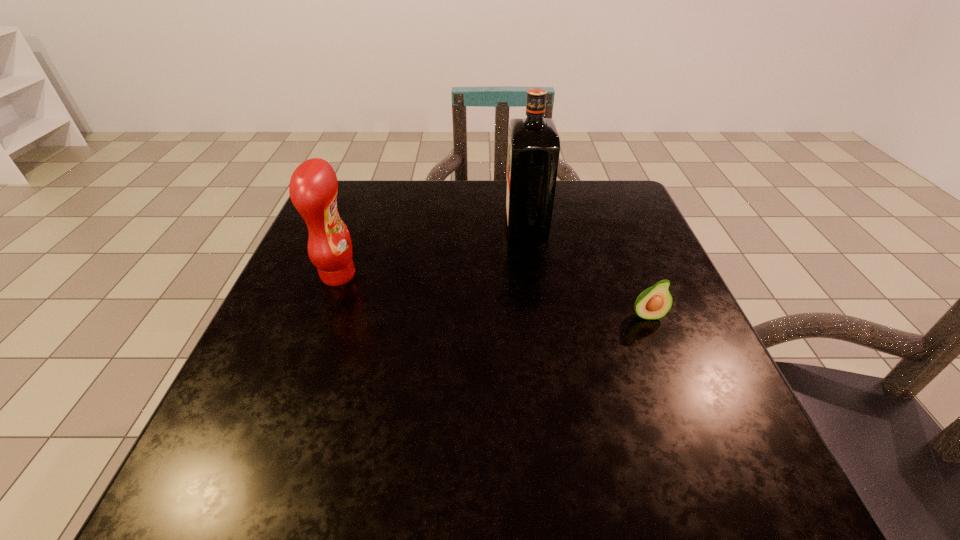
You are a GUI agent. You are given a task and a screenshot of the screen. Output one action in this format:
    pyautogui.click(x=<x>, y=<y>)
    Task: Click on the free spot located on the cut side of the rightmost object
    Image resolution: width=960 pixels, height=540 pixels.
    Given the screenshot: What is the action you would take?
    pyautogui.click(x=694, y=435)

This screenshot has width=960, height=540. Identify the location of object that is positioned at the far edge. (534, 145).

Locate an element on the screen. The width and height of the screenshot is (960, 540). object present at the left edge is located at coordinates (313, 187).

The width and height of the screenshot is (960, 540). What are the coordinates of `object located at the right edge` in the screenshot? It's located at (655, 302).

Identify the location of free point at the far edge. The image size is (960, 540). (458, 186).

I want to click on free space at the near edge of the desktop, so click(x=373, y=465).

Image resolution: width=960 pixels, height=540 pixels. I want to click on vacant space at the left edge of the desktop, so click(x=348, y=328).

You are a GUI agent. You are given a task and a screenshot of the screen. Output one action in this format:
    pyautogui.click(x=<x>, y=<y>)
    Task: Click on the free region at the right edge of the desktop
    
    Given the screenshot: What is the action you would take?
    pyautogui.click(x=616, y=244)

Identify the location of free space at the far right corner of the desktop. The image size is (960, 540). (588, 180).

Where is `free space between the leftmost object and the farthest object`? free space between the leftmost object and the farthest object is located at coordinates (432, 250).